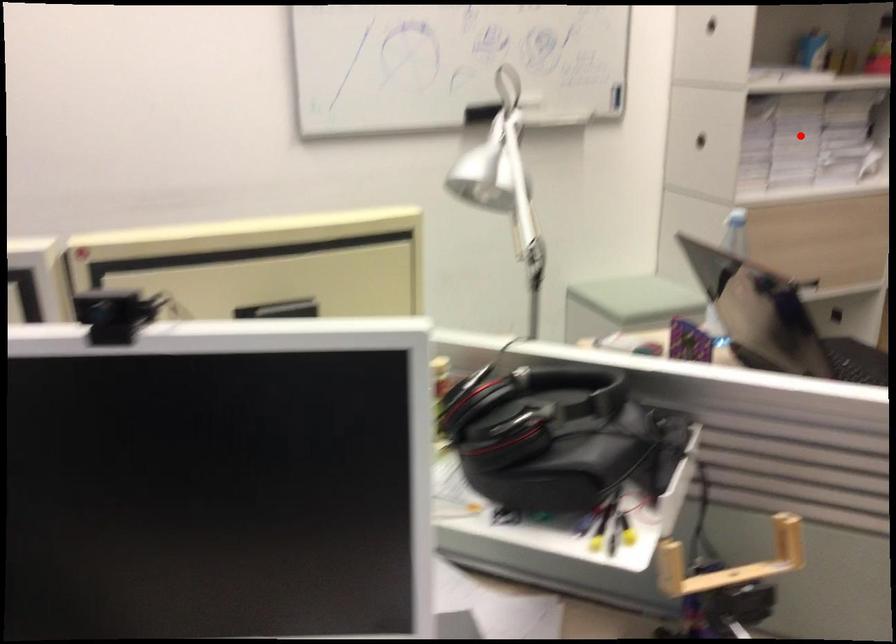
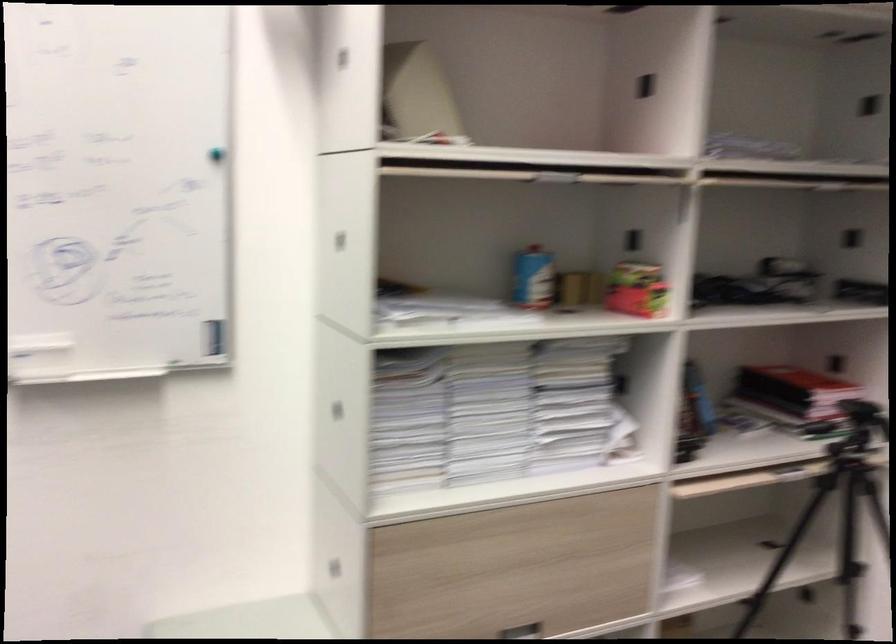
Question: I am providing you with two images of the same scene from different viewpoints. A red point is shown in image1. For the corresponding object point in image2, is it positioned nearer or farther from the camera?

Choices:
 (A) Nearer
 (B) Farther

Answer: (A)